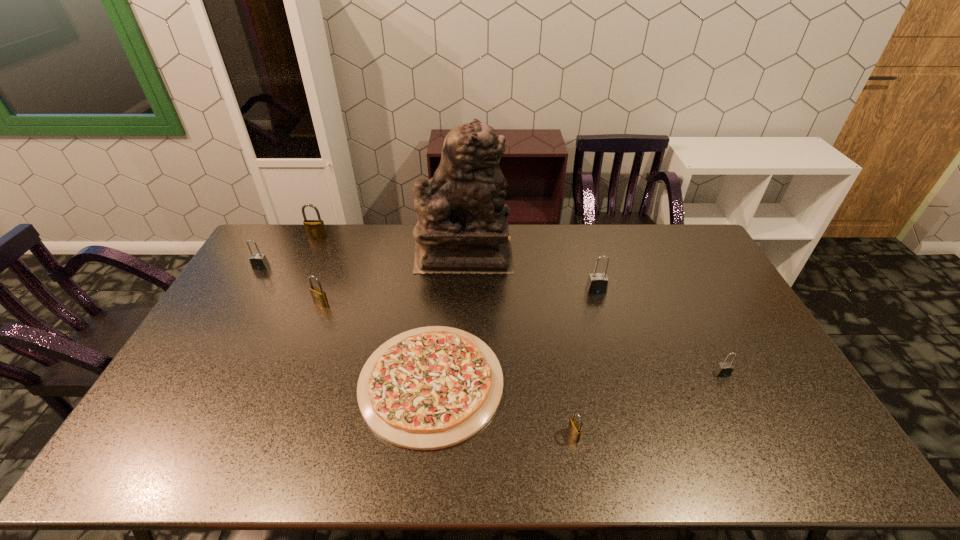
Where is `free space at the left edge of the desktop`? The image size is (960, 540). free space at the left edge of the desktop is located at coordinates (286, 272).

Identify the location of free location at the right edge. The height and width of the screenshot is (540, 960). (714, 271).

In the image, there is a desktop. Where is `blank space at the far left corner`? The image size is (960, 540). blank space at the far left corner is located at coordinates (283, 239).

Locate an element on the screen. vacant space at the far right corner of the desktop is located at coordinates (654, 234).

Locate an element on the screen. This screenshot has width=960, height=540. free space between the tallest object and the leftmost object is located at coordinates (363, 260).

The height and width of the screenshot is (540, 960). Identify the location of blank region between the pizza and the sculpture. (447, 318).

Locate an element on the screen. free point between the sculpture and the second brass padlock from right to left is located at coordinates (393, 279).

You are a GUI agent. You are given a task and a screenshot of the screen. Output one action in this format:
    pyautogui.click(x=<x>, y=<y>)
    Task: Click on the free space that is in between the tallest object and the second gray padlock from left to right
    The height and width of the screenshot is (540, 960).
    Given the screenshot: What is the action you would take?
    pyautogui.click(x=530, y=272)

What are the coordinates of `vacant point located between the leftmost padlock and the sculpture` in the screenshot? It's located at (363, 260).

This screenshot has width=960, height=540. Identify the location of free space that is in between the pizza and the fifth farthest object. (376, 343).